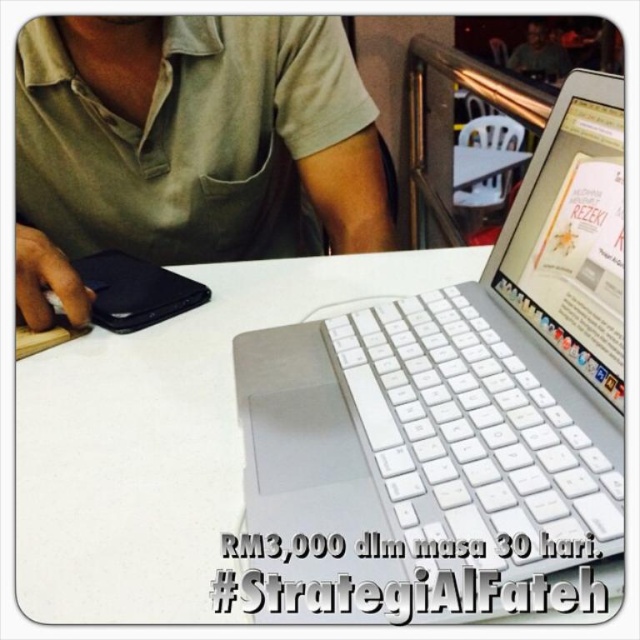
Question: Does white plastic laptop at center appear under white matte table at center?

Choices:
 (A) no
 (B) yes

Answer: (A)

Question: Which of the following is the farthest from the observer?

Choices:
 (A) white plastic laptop at center
 (B) green fabric shirt at upper left
 (C) white plastic keyboard at center
 (D) white matte table at center

Answer: (B)

Question: Which of the following is the farthest from the observer?

Choices:
 (A) white plastic keyboard at center
 (B) white plastic laptop at center
 (C) green fabric shirt at upper left
 (D) matte black laptop at upper center

Answer: (D)

Question: Does white matte table at center appear on the left side of matte black laptop at upper center?

Choices:
 (A) no
 (B) yes

Answer: (B)

Question: Among these objects, which one is nearest to the camera?

Choices:
 (A) matte black laptop at upper center
 (B) white plastic laptop at center
 (C) white plastic keyboard at center
 (D) white matte table at center

Answer: (B)

Question: Can you confirm if white plastic laptop at center is thinner than white plastic keyboard at center?

Choices:
 (A) no
 (B) yes

Answer: (A)